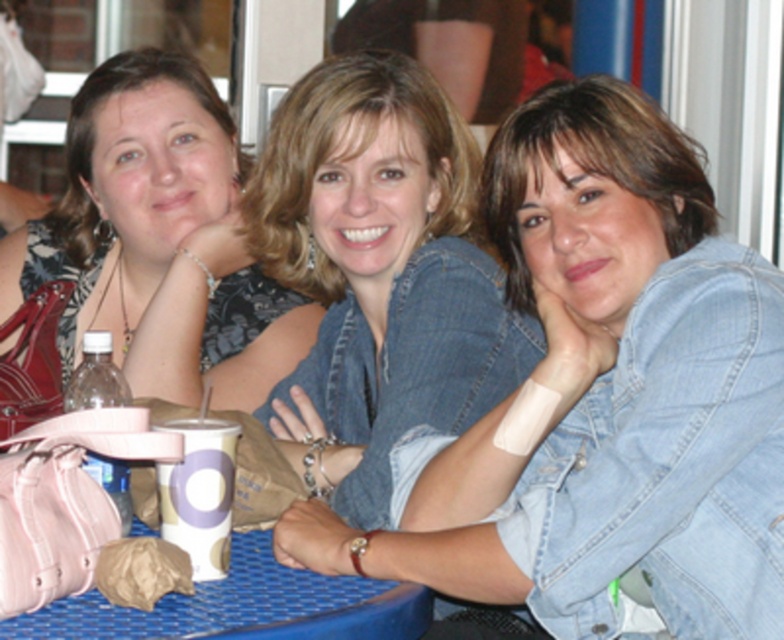
Between faded denim jacket at lower right and denim jacket at center, which one has more height?

faded denim jacket at lower right is taller.

Is faded denim jacket at lower right positioned before denim jacket at center?

Yes, faded denim jacket at lower right is closer to the viewer.

What do you see at coordinates (601, 401) in the screenshot? I see `faded denim jacket at lower right` at bounding box center [601, 401].

I want to click on faded denim jacket at lower right, so click(x=601, y=401).

Who is more distant from viewer, [403,326] or [231,227]?

The point [231,227] is behind.

Is denim jacket at center to the right of matte black dress at upper left from the viewer's perspective?

Yes, denim jacket at center is to the right of matte black dress at upper left.

Find the location of a particular element. denim jacket at center is located at coordinates [383, 264].

Which is in front, point (550, 556) or point (115, 188)?

Point (550, 556) is in front.

Between faded denim jacket at lower right and matte black dress at upper left, which one has more height?

faded denim jacket at lower right is taller.

Where is `faded denim jacket at lower right`? faded denim jacket at lower right is located at coordinates (601, 401).